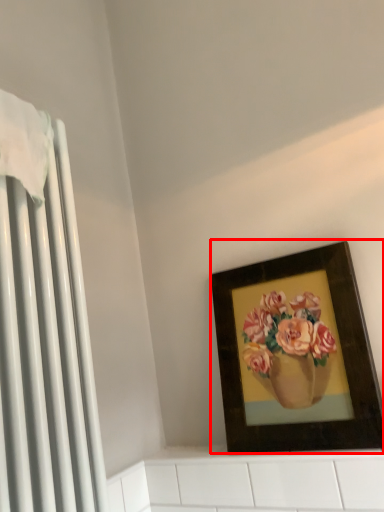
Question: From the image's perspective, what is the correct spatial positioning of picture frame (annotated by the red box) in reference to radiator?

Choices:
 (A) below
 (B) above

Answer: (A)